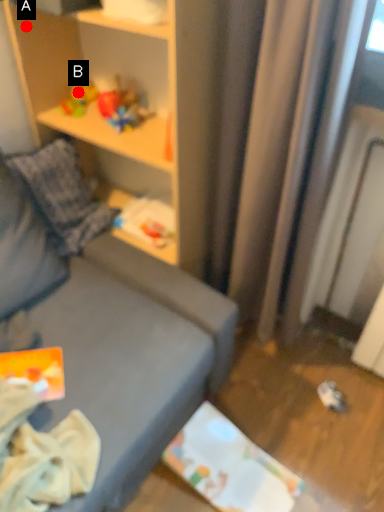
Question: Two points are circled on the image, labeled by A and B beside each circle. Which point appears closest to the camera in this image?

Choices:
 (A) A is closer
 (B) B is closer

Answer: (A)